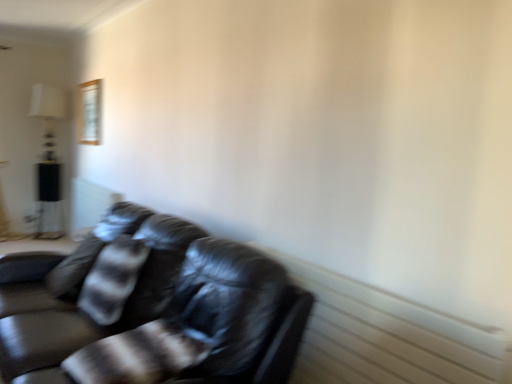
Question: Can you confirm if shiny black leather couch at lower left is smaller than wooden frame at upper left?

Choices:
 (A) yes
 (B) no

Answer: (B)

Question: From the image's perspective, would you say shiny black leather couch at lower left is positioned over wooden frame at upper left?

Choices:
 (A) no
 (B) yes

Answer: (A)

Question: Is shiny black leather couch at lower left positioned with its back to wooden frame at upper left?

Choices:
 (A) yes
 (B) no

Answer: (B)

Question: Can you confirm if shiny black leather couch at lower left is positioned to the left of wooden frame at upper left?

Choices:
 (A) no
 (B) yes

Answer: (A)

Question: Is shiny black leather couch at lower left oriented towards wooden frame at upper left?

Choices:
 (A) yes
 (B) no

Answer: (B)

Question: Is wooden frame at upper left taller or shorter than black glossy table at left?

Choices:
 (A) tall
 (B) short

Answer: (B)

Question: Is wooden frame at upper left situated inside black glossy table at left or outside?

Choices:
 (A) outside
 (B) inside

Answer: (A)

Question: From the image's perspective, is wooden frame at upper left positioned above or below black glossy table at left?

Choices:
 (A) below
 (B) above

Answer: (B)

Question: Is wooden frame at upper left to the left or to the right of black glossy table at left in the image?

Choices:
 (A) left
 (B) right

Answer: (B)

Question: Is black glossy table at left in front of or behind wooden frame at upper left in the image?

Choices:
 (A) behind
 (B) front

Answer: (A)

Question: Is black glossy table at left to the left or to the right of wooden frame at upper left in the image?

Choices:
 (A) left
 (B) right

Answer: (A)

Question: Considering the positions of black glossy table at left and wooden frame at upper left in the image, is black glossy table at left wider or thinner than wooden frame at upper left?

Choices:
 (A) wide
 (B) thin

Answer: (A)

Question: From a real-world perspective, relative to wooden frame at upper left, is black glossy table at left vertically above or below?

Choices:
 (A) above
 (B) below

Answer: (B)

Question: From the image's perspective, relative to shiny black leather couch at lower left, is wooden frame at upper left above or below?

Choices:
 (A) below
 (B) above

Answer: (B)

Question: From a real-world perspective, relative to shiny black leather couch at lower left, is wooden frame at upper left vertically above or below?

Choices:
 (A) above
 (B) below

Answer: (A)